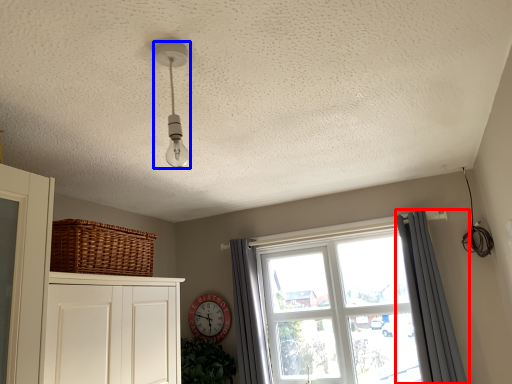
Question: Which of the following is the closest to the observer, curtain (highlighted by a red box) or light fixture (highlighted by a blue box)?

Choices:
 (A) curtain
 (B) light fixture

Answer: (B)